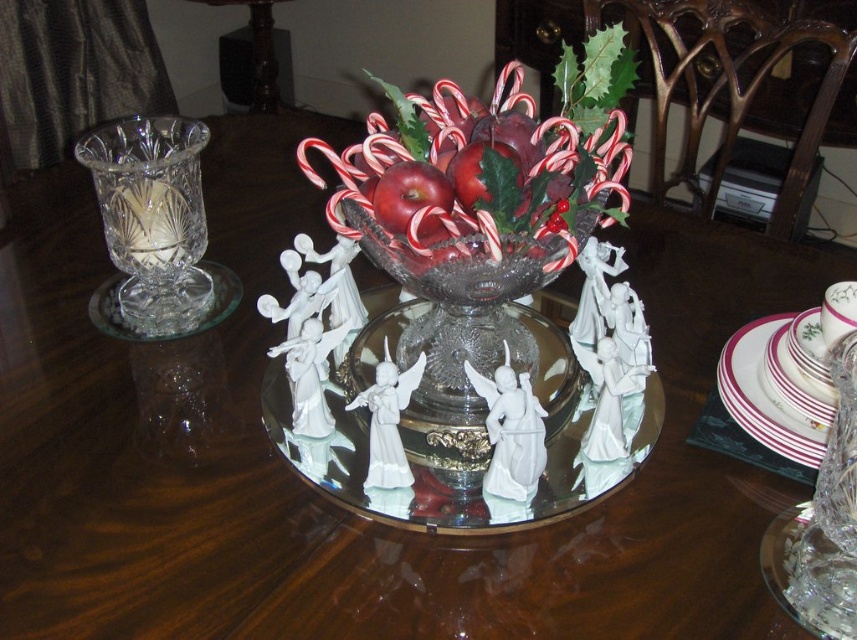
Between transparent glass bowl at center and white ceramic plate at right, which one appears on the right side from the viewer's perspective?

white ceramic plate at right

Which is more to the left, transparent glass bowl at center or white ceramic plate at right?

From the viewer's perspective, transparent glass bowl at center appears more on the left side.

Which is behind, point (414, 321) or point (774, 445)?

Positioned behind is point (414, 321).

Find the location of a particular element. The width and height of the screenshot is (857, 640). transparent glass bowl at center is located at coordinates (460, 314).

Locate an element on the screen. This screenshot has height=640, width=857. clear crystal vase at left is located at coordinates coord(153,218).

Is clear crystal vase at left to the right of transparent glass bowl at center from the viewer's perspective?

No, clear crystal vase at left is not to the right of transparent glass bowl at center.

The image size is (857, 640). Describe the element at coordinates (153, 218) in the screenshot. I see `clear crystal vase at left` at that location.

Where is `clear crystal vase at left`? clear crystal vase at left is located at coordinates (153, 218).

How distant is transparent glass bowl at center from red glossy apple at center?

The distance of transparent glass bowl at center from red glossy apple at center is 3.70 inches.

Image resolution: width=857 pixels, height=640 pixels. Describe the element at coordinates (460, 314) in the screenshot. I see `transparent glass bowl at center` at that location.

Is point (424, 262) behind point (381, 220)?

That is True.

Image resolution: width=857 pixels, height=640 pixels. What are the coordinates of `transparent glass bowl at center` in the screenshot? It's located at (460, 314).